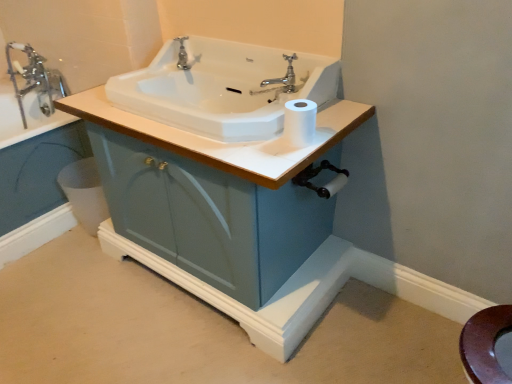
Where is `free space in front of polished chrome faucet at upper center, which ranks as the second tap in left-to-right order`? The width and height of the screenshot is (512, 384). free space in front of polished chrome faucet at upper center, which ranks as the second tap in left-to-right order is located at coordinates (x=178, y=81).